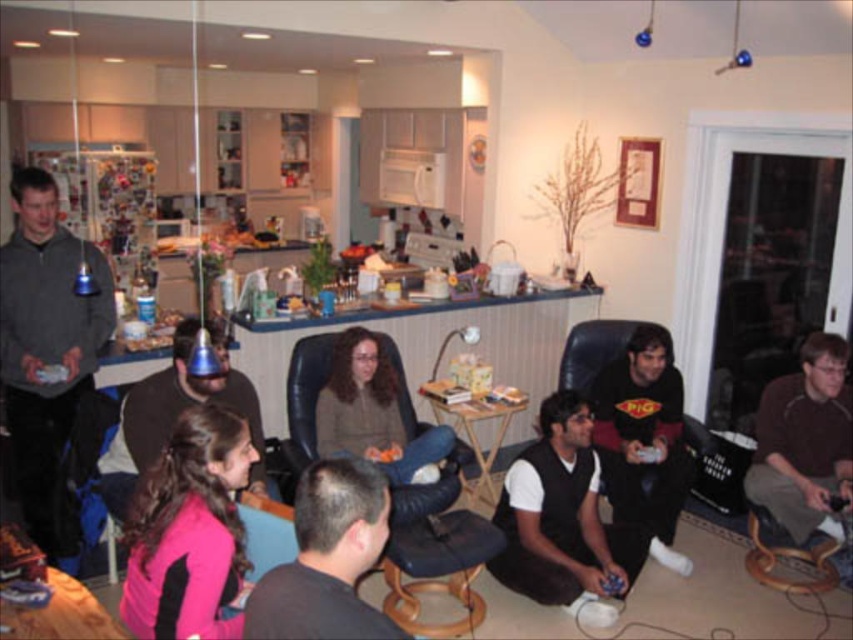
You are a photographer standing in the living area and want to take a photo that includes both the point at (540, 580) and the point at (183, 369). Which point should you focus on first to ensure both are in focus?

You should focus on the point at (183, 369) first because it is closer to you than the point at (540, 580), which is further away. By focusing on the closer point, the further point will still be within the depth of field.

You are standing in the living area of the described scene. There is a point marked at coordinates (x=643, y=438). What object or feature is located at this point?

The point at coordinates (x=643, y=438) marks the location of the black matte shirt at lower right.